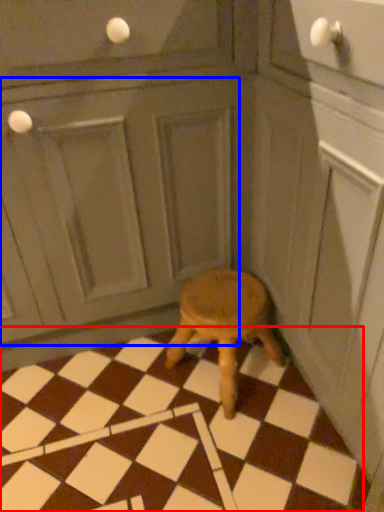
Question: Which point is further to the camera, tile (highlighted by a red box) or screen door (highlighted by a blue box)?

Choices:
 (A) tile
 (B) screen door

Answer: (A)